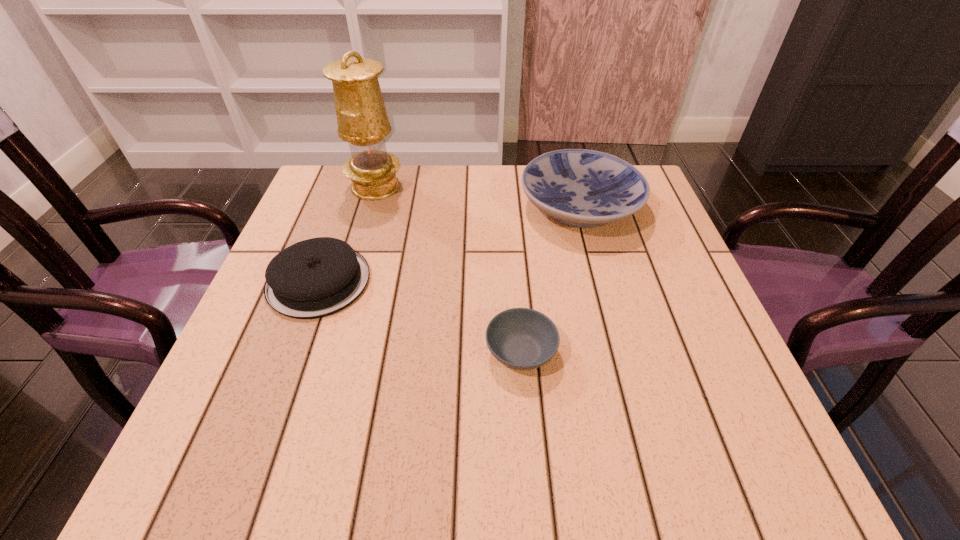
Where is `vacant space at the right edge of the desktop`? The width and height of the screenshot is (960, 540). vacant space at the right edge of the desktop is located at coordinates (676, 396).

You are a GUI agent. You are given a task and a screenshot of the screen. Output one action in this format:
    pyautogui.click(x=<x>, y=<y>)
    Task: Click on the free space that is in between the tallest object and the shortest object
    The height and width of the screenshot is (540, 960).
    Given the screenshot: What is the action you would take?
    pyautogui.click(x=448, y=269)

This screenshot has width=960, height=540. Identify the location of vacant space in between the third farthest object and the plate. (449, 244).

You are a GUI agent. You are given a task and a screenshot of the screen. Output one action in this format:
    pyautogui.click(x=<x>, y=<y>)
    Task: Click on the unoccupied area between the oil lamp and the plate
    The height and width of the screenshot is (540, 960).
    Given the screenshot: What is the action you would take?
    pyautogui.click(x=478, y=197)

The width and height of the screenshot is (960, 540). What are the coordinates of `unoccupied position between the plate and the soup bowl` in the screenshot? It's located at (550, 279).

At what (x,y) coordinates should I click in order to perform the action: click on vacant area that lies between the pancake and the soup bowl. Please return your answer as a coordinate pair (x, y). The width and height of the screenshot is (960, 540). Looking at the image, I should click on (420, 316).

Identify the location of free space that is in between the plate and the tallest object. (478, 197).

Find the location of a particular element. unoccupied position between the second nearest object and the plate is located at coordinates (449, 244).

What are the coordinates of `free point between the third tallest object and the oil lamp` in the screenshot? It's located at (348, 234).

The image size is (960, 540). What are the coordinates of `vacant region between the second nearest object and the nearest object` in the screenshot? It's located at (420, 316).